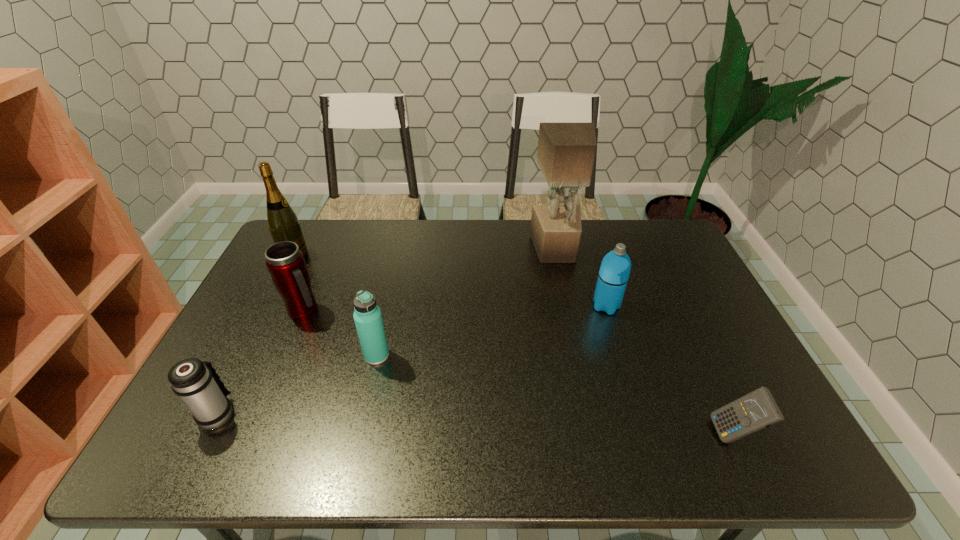
At what (x,y) coordinates should I click in order to perform the action: click on vacant position located 0.220m on the front-facing side of the rightmost object. Please return your answer as a coordinate pair (x, y). Looking at the image, I should click on (616, 434).

Image resolution: width=960 pixels, height=540 pixels. In order to click on sculpture that is at the far edge in this screenshot , I will do `click(566, 151)`.

You are a GUI agent. You are given a task and a screenshot of the screen. Output one action in this format:
    pyautogui.click(x=<x>, y=<y>)
    Task: Click on the wine bottle that is at the far edge
    The image size is (960, 540).
    Given the screenshot: What is the action you would take?
    pyautogui.click(x=283, y=223)

This screenshot has height=540, width=960. Identify the location of thermos bottle situated at the near edge. (199, 386).

Find the location of a particular element. calculator that is at the near edge is located at coordinates click(x=756, y=410).

At what (x,y) coordinates should I click in order to perform the action: click on wine bottle at the left edge. Please return your answer as a coordinate pair (x, y). This screenshot has width=960, height=540. Looking at the image, I should click on (283, 223).

Find the location of a particular element. This screenshot has height=540, width=960. object situated at the right edge is located at coordinates (756, 410).

Locate an element on the screen. The height and width of the screenshot is (540, 960). object present at the far left corner is located at coordinates (283, 223).

This screenshot has width=960, height=540. I want to click on object that is at the near left corner, so click(x=199, y=386).

Locate an element on the screen. The image size is (960, 540). object that is positioned at the near right corner is located at coordinates (756, 410).